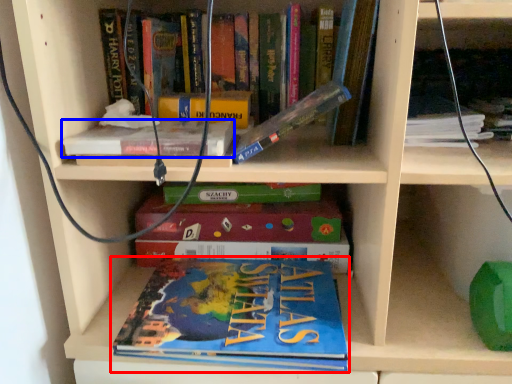
Question: Among these objects, which one is nearest to the camera, book (highlighted by a red box) or book (highlighted by a blue box)?

Choices:
 (A) book
 (B) book

Answer: (B)